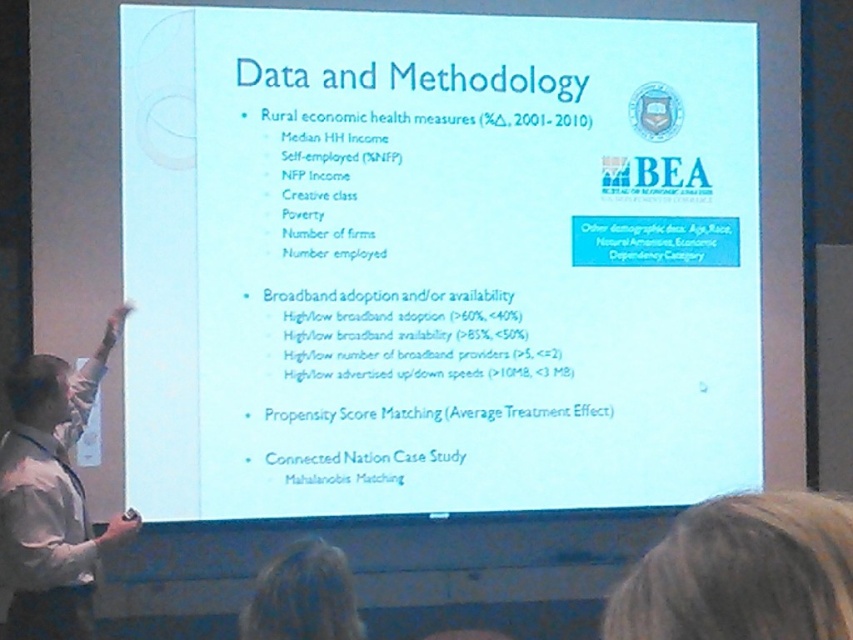
What is the spatial position of the white paper at center in the image?

The white paper at center is located at point coordinates of (436, 260).

You are an attendee at this event and want to ask a question to the presenter. You see the white shirt at left and the blonde hair at lower center. Which one is closer to the left side of the room?

The white shirt at left is closer to the left side of the room since it is positioned to the left of the blonde hair at lower center.

You are standing in the room where this presentation is taking place. You need to pick up the white paper at center from the floor. Can you reach it without moving closer than your current position?

The white paper at center is 18.60 feet away from the viewer. Since the average person can only reach about 10 feet, you cannot reach it without moving closer.